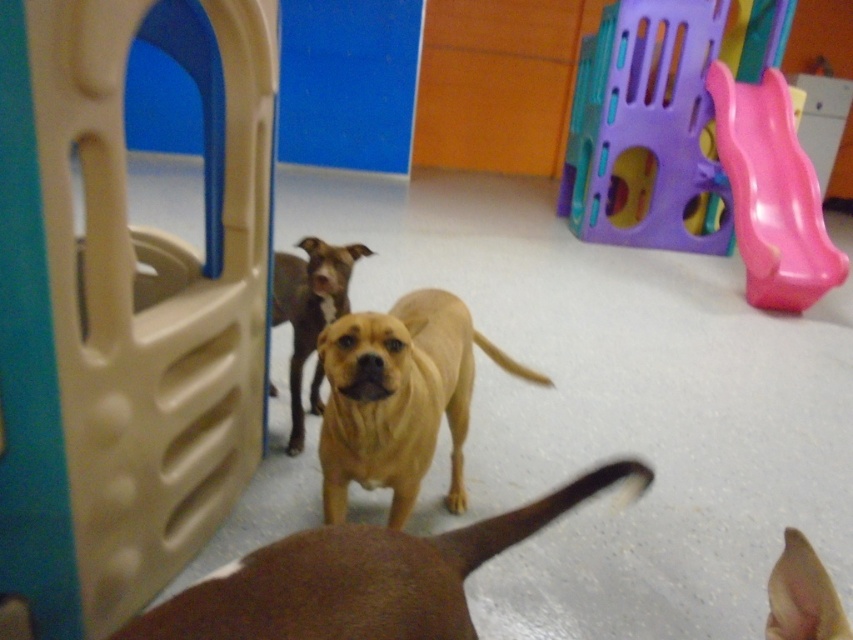
In the scene shown: Who is lower down, golden smooth dog at center or brown matte dog at lower right?

brown matte dog at lower right

Is golden smooth dog at center to the left of brown matte dog at lower right from the viewer's perspective?

Yes, golden smooth dog at center is to the left of brown matte dog at lower right.

Is point (326, 435) closer to camera compared to point (840, 605)?

That is False.

Where is `golden smooth dog at center`? The height and width of the screenshot is (640, 853). golden smooth dog at center is located at coordinates (399, 397).

Who is shorter, beige plastic playhouse at left or golden smooth dog at center?

Standing shorter between the two is golden smooth dog at center.

This screenshot has width=853, height=640. Describe the element at coordinates (125, 308) in the screenshot. I see `beige plastic playhouse at left` at that location.

Does point (61, 515) lie in front of point (384, 404)?

That is True.

This screenshot has height=640, width=853. In order to click on beige plastic playhouse at left in this screenshot , I will do `click(125, 308)`.

Can you confirm if brown matte dog at center is bigger than brown matte dog at lower right?

Yes, brown matte dog at center is bigger than brown matte dog at lower right.

What do you see at coordinates (360, 577) in the screenshot? I see `brown matte dog at center` at bounding box center [360, 577].

Identify the location of brown matte dog at center. Image resolution: width=853 pixels, height=640 pixels. [x=360, y=577].